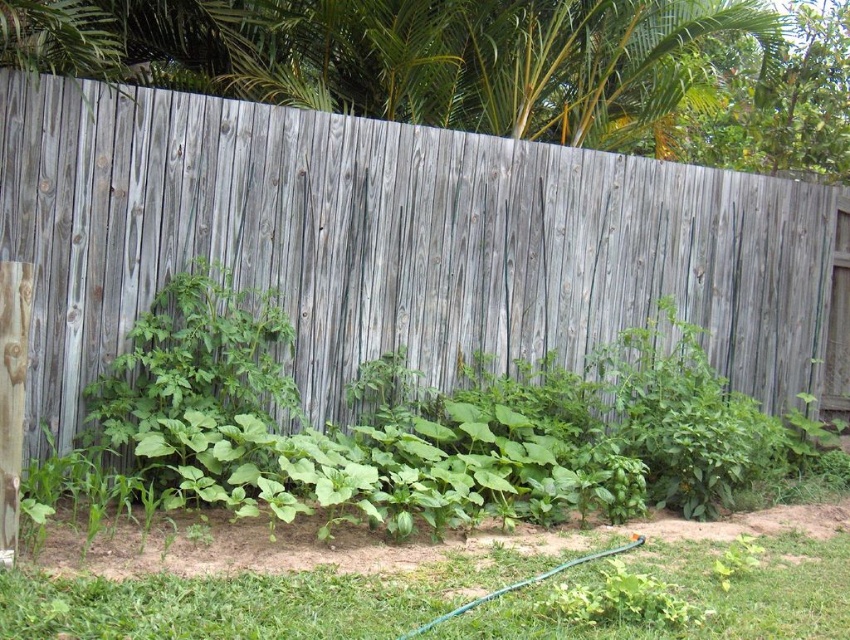
Which of these two, weathered wood fence at center or green grass at lower center, stands taller?

weathered wood fence at center

Is weathered wood fence at center to the right of green grass at lower center from the viewer's perspective?

Indeed, weathered wood fence at center is positioned on the right side of green grass at lower center.

Locate an element on the screen. The image size is (850, 640). weathered wood fence at center is located at coordinates [400, 243].

Who is shorter, green grass at lower center or green rubber hose at lower center?

green rubber hose at lower center is shorter.

Who is positioned more to the right, green grass at lower center or green rubber hose at lower center?

green rubber hose at lower center is more to the right.

This screenshot has height=640, width=850. Find the location of `green grass at lower center`. green grass at lower center is located at coordinates (247, 602).

Locate an element on the screen. The image size is (850, 640). green grass at lower center is located at coordinates (247, 602).

Who is positioned more to the right, weathered wood fence at center or green rubber hose at lower center?

From the viewer's perspective, weathered wood fence at center appears more on the right side.

Who is more distant from viewer, (x=404, y=221) or (x=553, y=566)?

Point (x=404, y=221)

Locate an element on the screen. The image size is (850, 640). weathered wood fence at center is located at coordinates (400, 243).